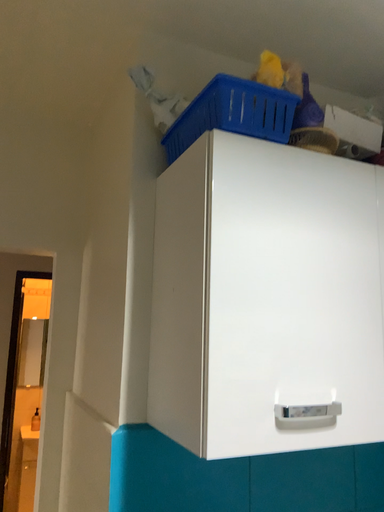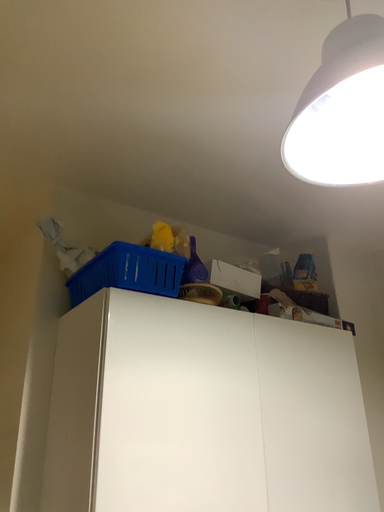
Question: Which way did the camera rotate in the video?

Choices:
 (A) rotated left
 (B) rotated right

Answer: (B)